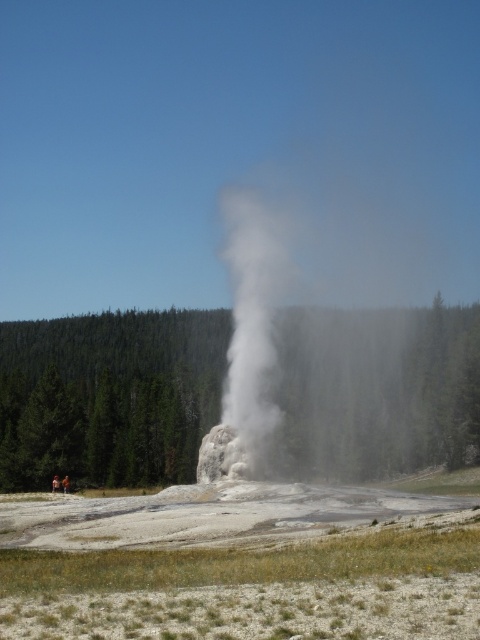
Consider the image. You are standing at the point marked by point (108, 396) in the image. Looking around, you see the green textured tree at center. Which direction should you walk to avoid the geyser eruption shown in the scene?

The green textured tree at center is located at point (108, 396). To avoid the geyser eruption, you should move away from the geyser, which is likely in the opposite direction of the dense forest of evergreen trees in the background. Since the trees are in the background, walking towards them would take you away from the geyser.

You are a hiker standing at the edge of the geyser area and see the green textured tree at center and the white vapor at center. Which object is closer to the ground?

The green textured tree at center is closer to the ground than the white vapor at center because it is positioned below it.